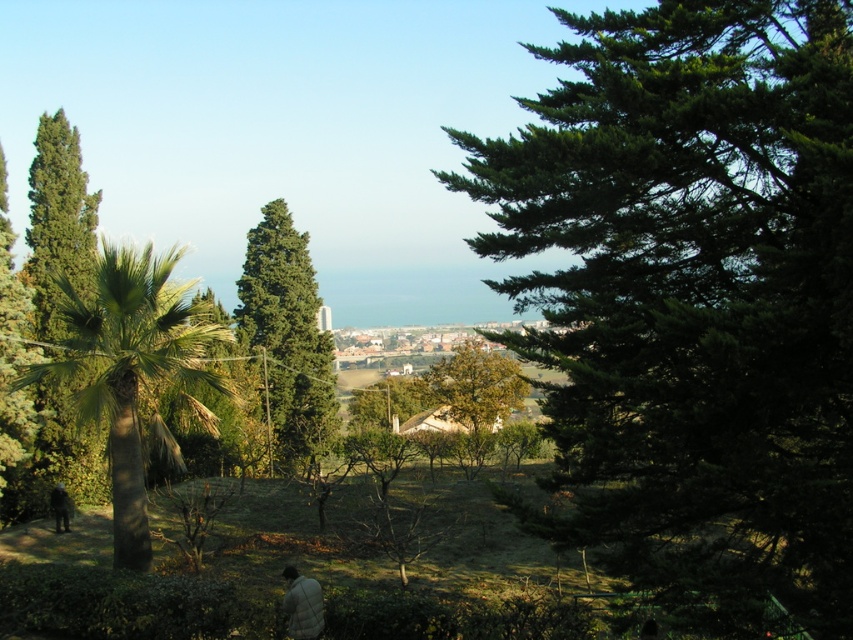
You are standing in the serene landscape scene described. You want to take a photo of the white fuzzy jacket at lower center without the green textured tree at center blocking the view. Which direction should you move to ensure the tree is out of frame?

The green textured tree at center is positioned over the white fuzzy jacket at lower center. To avoid the tree blocking the jacket, move to the right or left side so the tree is no longer above the jacket in your view.

You are standing in the serene landscape scene and want to walk from the palm tree to the coniferous trees. Which point, point (297,419) or point (294,609), is closer to you as you start walking?

Point (297,419) is closer to you because it is further to the viewer than point (294,609).